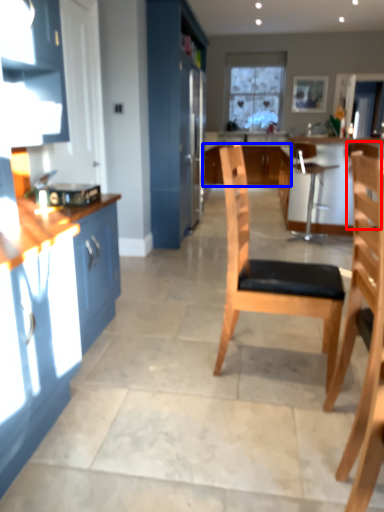
Question: Which of the following is the farthest to the observer, armchair (highlighted by a red box) or cabinetry (highlighted by a blue box)?

Choices:
 (A) armchair
 (B) cabinetry

Answer: (B)